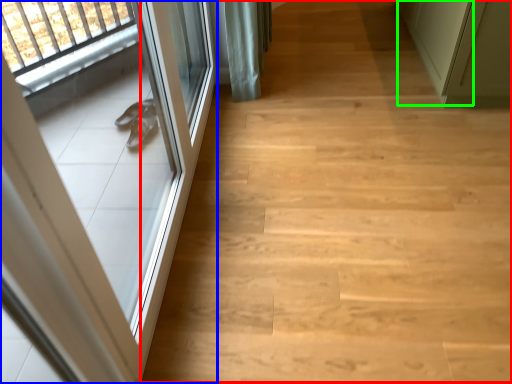
Question: Which is nearer to the stairwell (highlighted by a red box)? door (highlighted by a blue box) or door (highlighted by a green box).

Choices:
 (A) door
 (B) door

Answer: (A)